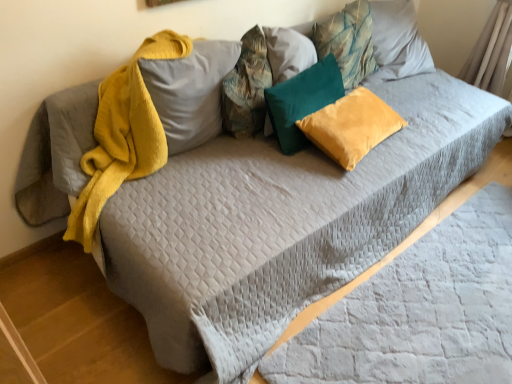
Find the location of a particular element. This screenshot has height=384, width=512. free point below gray quilted sheet at lower right (from a real-world perspective) is located at coordinates (444, 314).